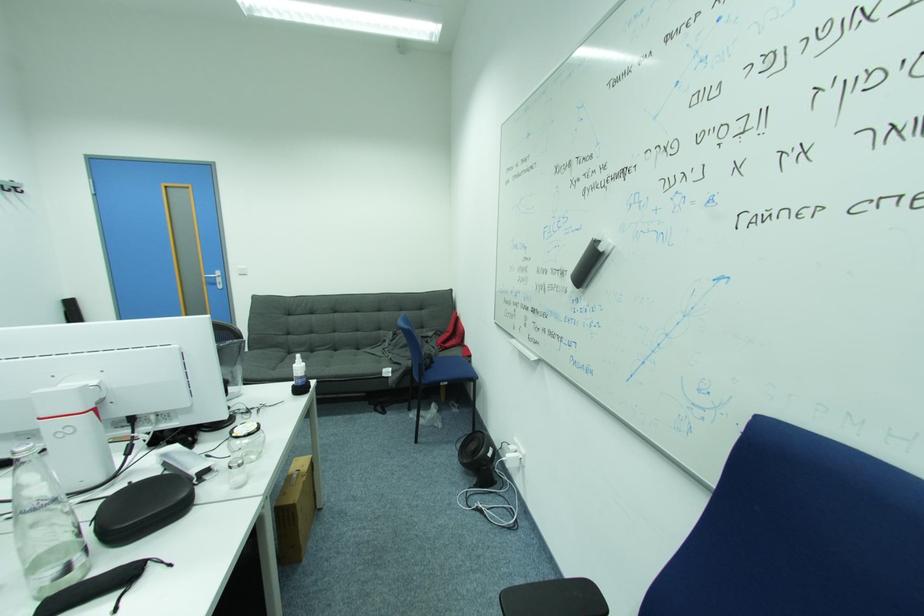
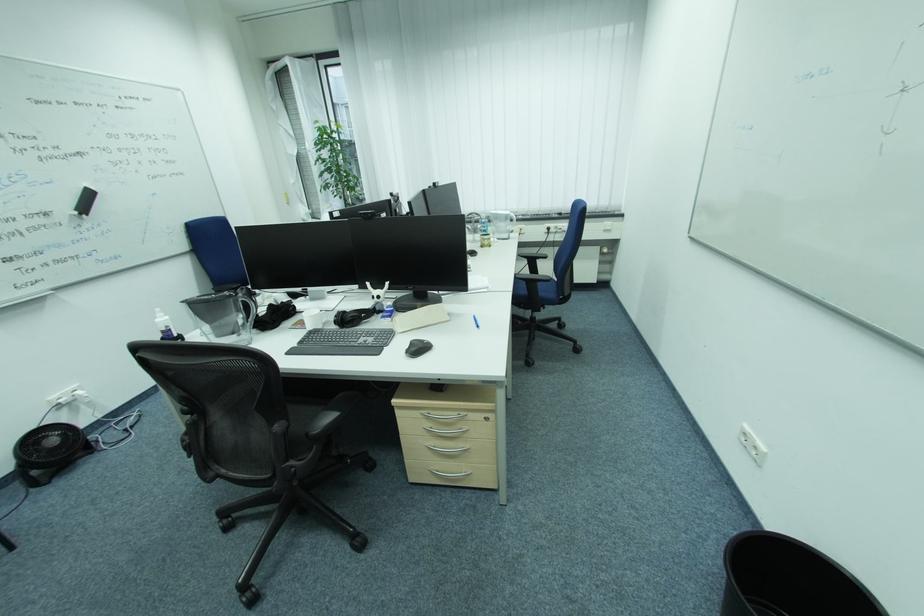
Question: I am providing you with two images of the same scene from different viewpoints. After the viewpoint changes to image2, which objects are now occluded?

Choices:
 (A) silver drawer handle
 (B) black headphones
 (C) hanger clip
 (D) glass jar lid

Answer: (D)